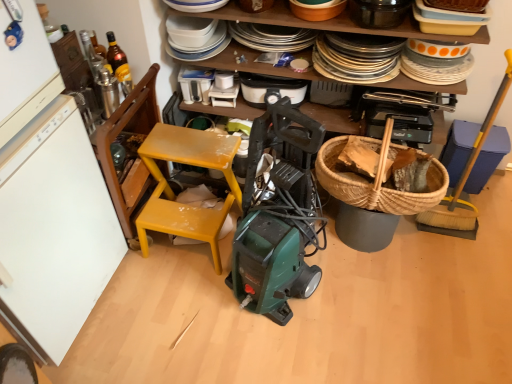
You are a GUI agent. You are given a task and a screenshot of the screen. Output one action in this format:
    pyautogui.click(x=<x>, y=<y>)
    Task: Click on the vacant area that is situated to the right of yellow plastic broom at right, which is the sixth appliance from left to right
    
    Given the screenshot: What is the action you would take?
    pyautogui.click(x=494, y=216)